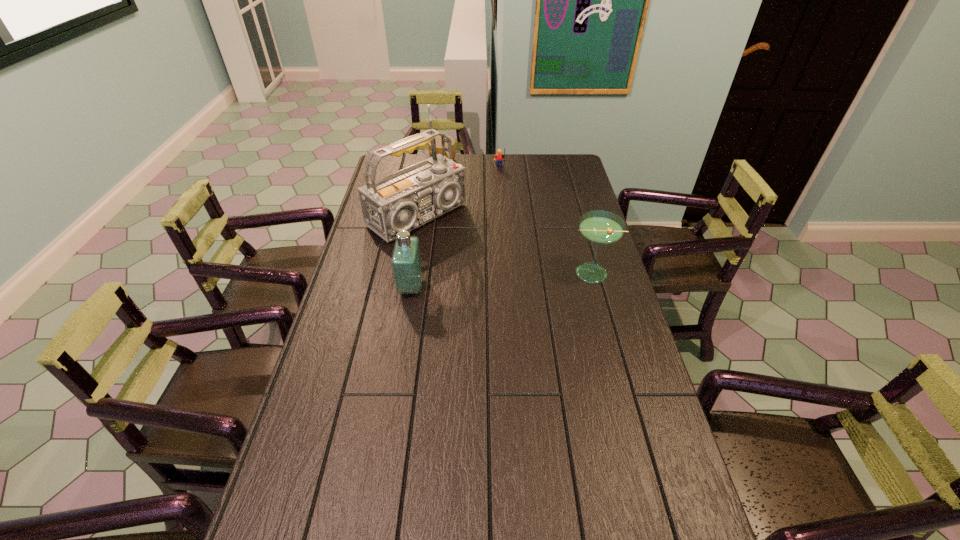
I want to click on object that can be found as the third closest to the third nearest object, so click(x=499, y=157).

Point out which object is positioned as the fourth nearest to the mug. Please provide its 2D coordinates. Your answer should be formatted as a tuple, i.e. [(x, y)], where the tuple contains the x and y coordinates of a point satisfying the conditions above.

[(599, 227)]

You are a GUI agent. You are given a task and a screenshot of the screen. Output one action in this format:
    pyautogui.click(x=<x>, y=<y>)
    Task: Click on the free location that satisfies the following two spatial constraints: 1. on the front side of the mug; 2. on the right side of the martini
    This screenshot has width=960, height=540.
    Given the screenshot: What is the action you would take?
    pyautogui.click(x=429, y=273)

Find the location of a particular element. Image resolution: width=960 pixels, height=540 pixels. vacant point that satisfies the following two spatial constraints: 1. on the front side of the martini; 2. on the right side of the fourth object from left to right is located at coordinates (506, 273).